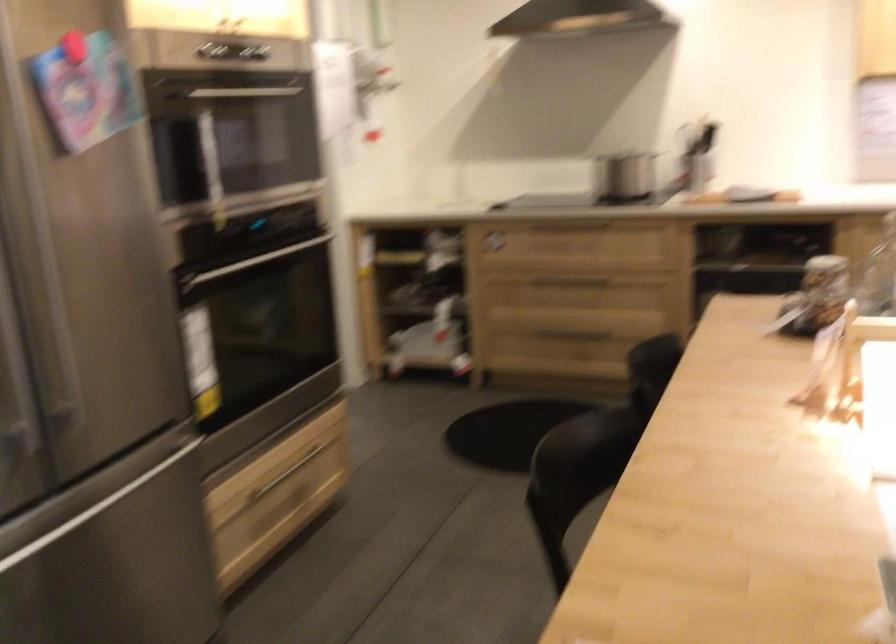
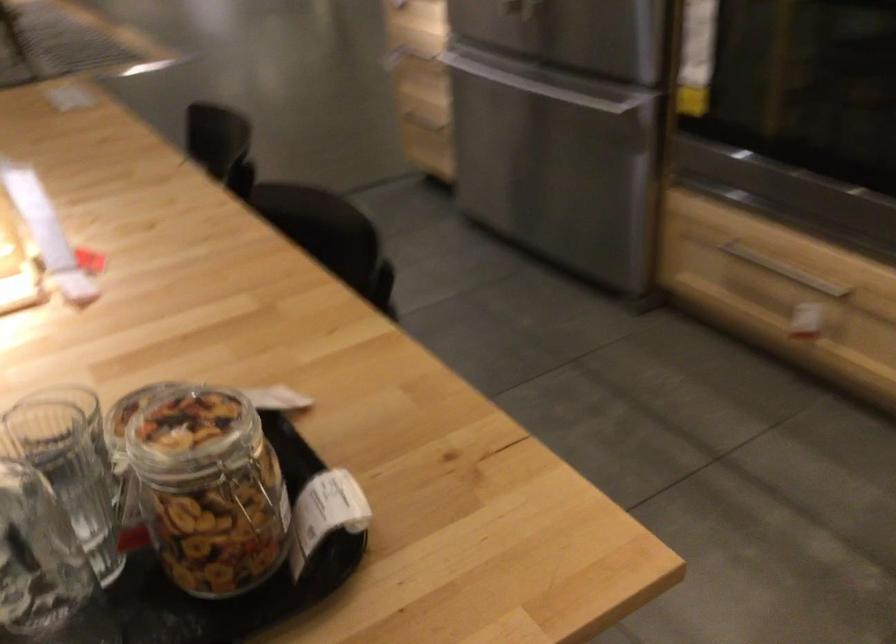
Find the pixel in the second image that matches [298,466] in the first image.

(784, 270)